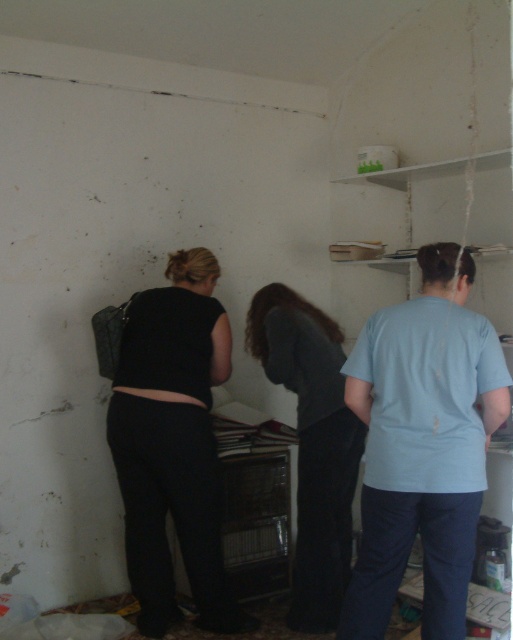
Question: Does light blue t-shirt at center appear on the right side of dark gray fabric at center?

Choices:
 (A) yes
 (B) no

Answer: (A)

Question: Which point appears closest to the camera in this image?

Choices:
 (A) (416, 364)
 (B) (304, 492)
 (C) (204, 380)

Answer: (A)

Question: Does light blue t-shirt at center appear over black matte pants at center?

Choices:
 (A) no
 (B) yes

Answer: (B)

Question: Which object appears farthest from the camera in this image?

Choices:
 (A) light blue t-shirt at center
 (B) dark gray fabric at center

Answer: (B)

Question: Which point is farther to the camera?

Choices:
 (A) (305, 428)
 (B) (466, 536)

Answer: (A)

Question: Is the position of light blue t-shirt at center more distant than that of black matte pants at center?

Choices:
 (A) yes
 (B) no

Answer: (B)